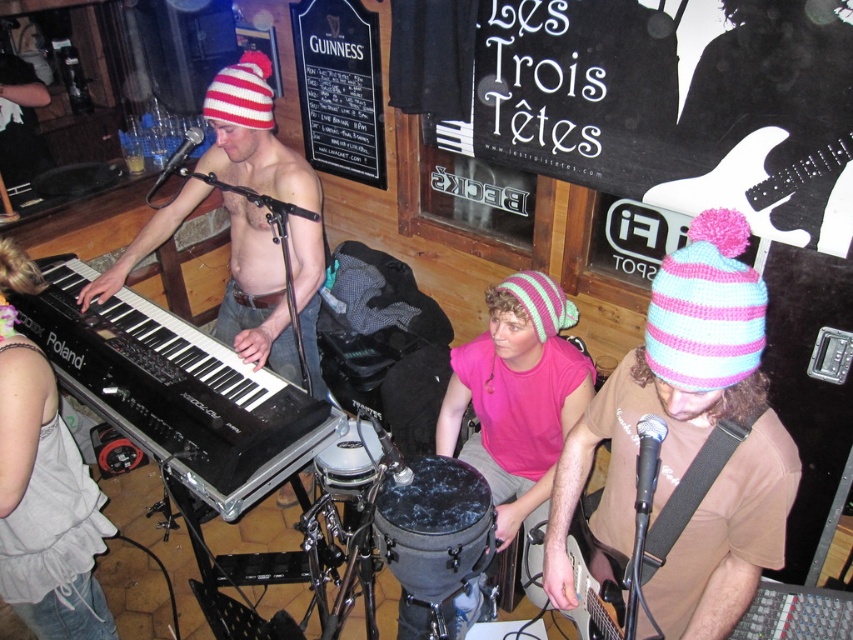
You are a performer who wants to write a message on the black chalkboard at upper center and also place your pink knitted beanie at center on the board. Can you fit both items side by side on the chalkboard without overlapping?

The black chalkboard at upper center is wider than the pink knitted beanie at center, so yes, you can fit both items side by side on the chalkboard without overlapping.

You are a guest at the music venue and want to read the black chalkboard at upper center while also keeping an eye on the pink knitted beanie at center. Is the chalkboard blocking your view of the beanie?

The black chalkboard at upper center is positioned over the pink knitted beanie at center, so it would block your view of the beanie.